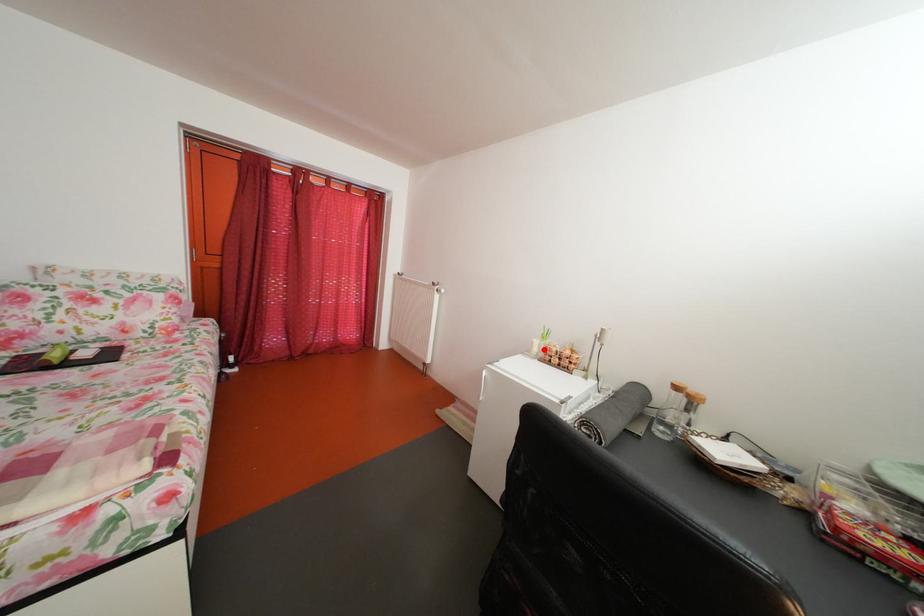
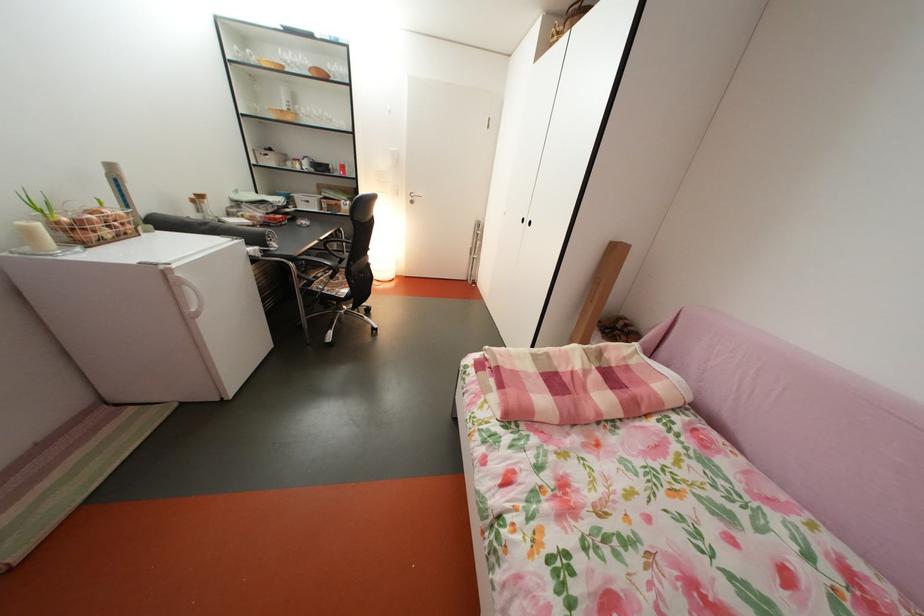
Where in the second image is the point corresponding to the highlighted location from the first image?

(41, 238)